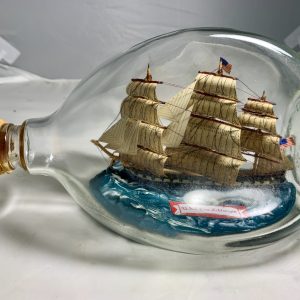
I want to click on glass bottle, so click(176, 51).